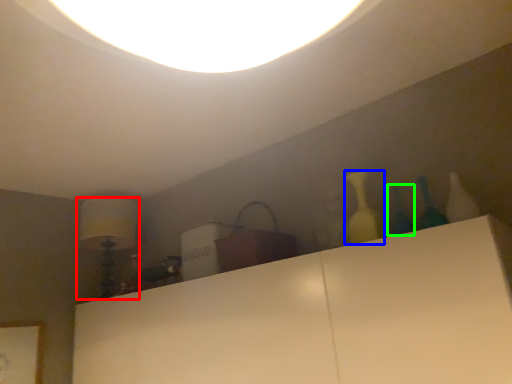
Question: Which object is the farthest from lamp (highlighted by a red box)? Choose among these: bottle (highlighted by a blue box) or glass vase (highlighted by a green box).

Choices:
 (A) bottle
 (B) glass vase

Answer: (B)